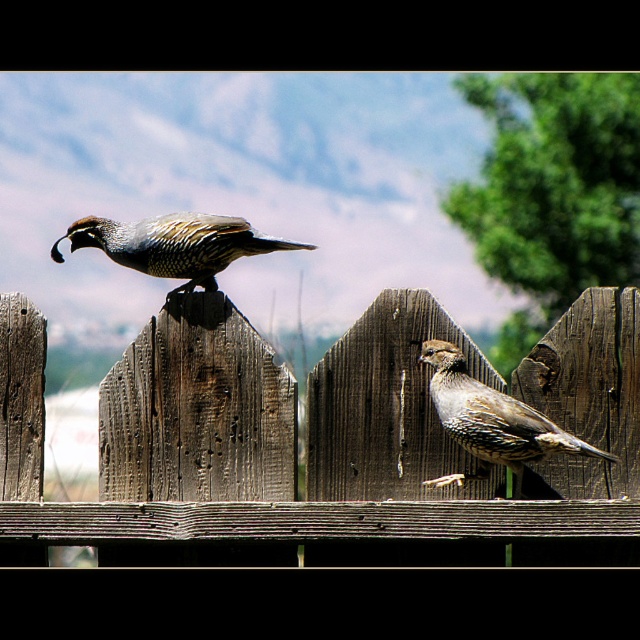
Question: Can you confirm if weathered wood fence at center is positioned below speckled feathered quail at center?

Choices:
 (A) no
 (B) yes

Answer: (B)

Question: Which of the following is the farthest from the observer?

Choices:
 (A) (218, 260)
 (B) (355, 541)
 (C) (566, 452)

Answer: (A)

Question: Is weathered wood fence at center thinner than speckled feathered quail at center?

Choices:
 (A) no
 (B) yes

Answer: (A)

Question: Among these points, which one is farthest from the camera?

Choices:
 (A) (84, 218)
 (B) (172, 456)

Answer: (A)

Question: Which of the following is the farthest from the observer?

Choices:
 (A) (131, 435)
 (B) (216, 260)
 (C) (458, 401)

Answer: (B)

Question: Is weathered wood fence at center thinner than speckled feathered quail at center?

Choices:
 (A) yes
 (B) no

Answer: (B)